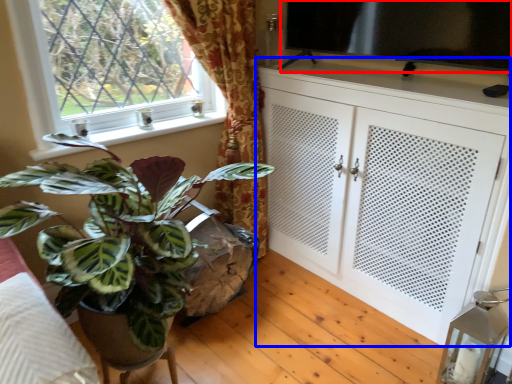
Question: Which point is further to the camera, window screen (highlighted by a red box) or cabinetry (highlighted by a blue box)?

Choices:
 (A) window screen
 (B) cabinetry

Answer: (A)